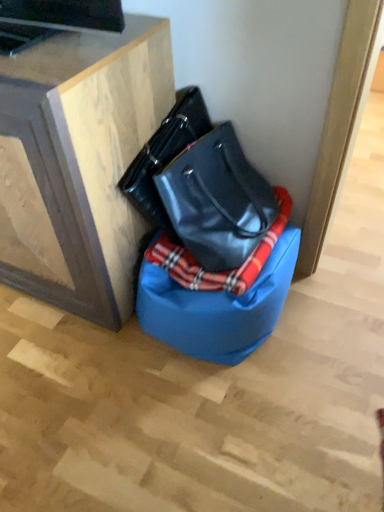
Question: Should I look upward or downward to see wooden cabinet at upper left?

Choices:
 (A) down
 (B) up

Answer: (B)

Question: Is glossy black handbag at center positioned with its back to plaid fabric blanket at center?

Choices:
 (A) yes
 (B) no

Answer: (B)

Question: Can you confirm if glossy black handbag at center is wider than plaid fabric blanket at center?

Choices:
 (A) yes
 (B) no

Answer: (B)

Question: Considering the relative positions of glossy black handbag at center and plaid fabric blanket at center in the image provided, is glossy black handbag at center behind plaid fabric blanket at center?

Choices:
 (A) no
 (B) yes

Answer: (A)

Question: From the image's perspective, is glossy black handbag at center located above plaid fabric blanket at center?

Choices:
 (A) no
 (B) yes

Answer: (B)

Question: Does glossy black handbag at center appear on the left side of plaid fabric blanket at center?

Choices:
 (A) no
 (B) yes

Answer: (B)

Question: Is glossy black handbag at center to the right of plaid fabric blanket at center from the viewer's perspective?

Choices:
 (A) no
 (B) yes

Answer: (A)

Question: Is blue fabric bean bag chair at lower center at the back of plaid fabric blanket at center?

Choices:
 (A) no
 (B) yes

Answer: (A)

Question: Is plaid fabric blanket at center to the right of blue fabric bean bag chair at lower center from the viewer's perspective?

Choices:
 (A) no
 (B) yes

Answer: (B)

Question: Is plaid fabric blanket at center taller than blue fabric bean bag chair at lower center?

Choices:
 (A) yes
 (B) no

Answer: (B)

Question: From a real-world perspective, is plaid fabric blanket at center located beneath blue fabric bean bag chair at lower center?

Choices:
 (A) no
 (B) yes

Answer: (A)

Question: From the image's perspective, is plaid fabric blanket at center under blue fabric bean bag chair at lower center?

Choices:
 (A) no
 (B) yes

Answer: (A)

Question: Does plaid fabric blanket at center come behind blue fabric bean bag chair at lower center?

Choices:
 (A) no
 (B) yes

Answer: (B)

Question: Does wooden cabinet at upper left have a lesser width compared to plaid fabric blanket at center?

Choices:
 (A) yes
 (B) no

Answer: (B)